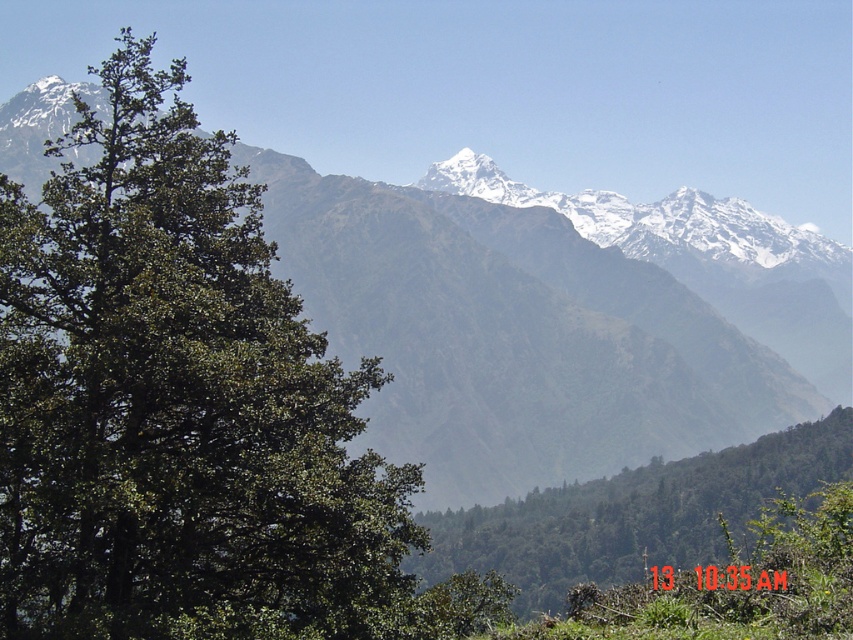
You are an environmental scientist analyzing this landscape. You need to determine which object occupies more horizontal space in the image between the green textured mountain range at center and the green leafy tree at center. Based on the scene, which one is wider?

The green textured mountain range at center is wider than the green leafy tree at center.

You are standing in the mountain landscape and see the green leafy tree at left and the green leafy tree at center. Which tree is positioned more to the east if the image is oriented with north at the top?

The green leafy tree at left is positioned more to the east because it is to the left of the green leafy tree at center, and the image is oriented with north at the top, meaning left corresponds to east.